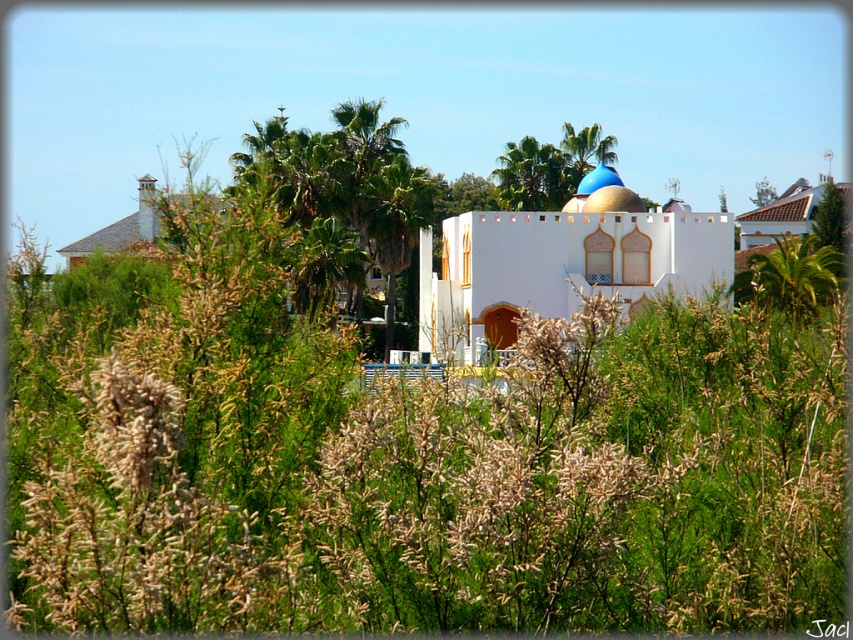
You are an architect designing a new landscape for a park. You have to place a white matte building at center and a green leafy palm tree at upper center. Given their sizes, which one should be placed first to ensure proper spacing?

The white matte building at center should be placed first because it is larger in size than the green leafy palm tree at upper center, ensuring there is enough space allocated for it during the design process.

Based on the scene description, where is the green leafy palm tree at upper center located in the image?

The green leafy palm tree at upper center is located at point (531, 176).

Looking at this image, you are an architect examining the landscape. You need to determine the spatial relationship between the white matte building at center and the blue glossy dome at upper center. Which object is positioned higher in the image?

The blue glossy dome at upper center is higher in the image because the white matte building at center is located below it.